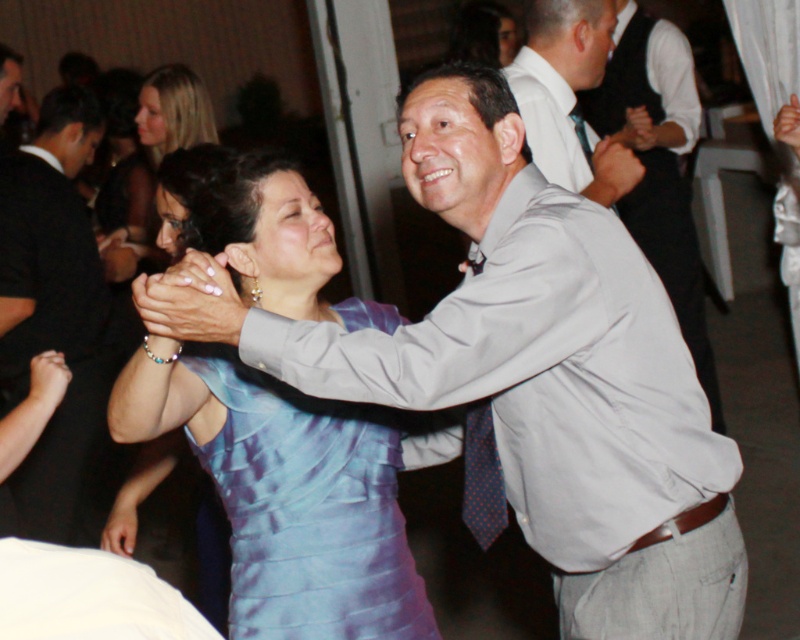
You are a photographer at the event and want to capture a photo of the light gray shirt at upper right and the satin blue dress at upper center. Based on their positions, which one should you focus on first to ensure both are in frame?

The light gray shirt at upper right has a greater height compared to the satin blue dress at upper center, so you should focus on the light gray shirt at upper right first to ensure both are in frame.

You are at the center of the scene and want to locate the matte black suit at left. In which direction should you look to find it?

The matte black suit at left is located at point 0.477 on the x axis and 0.066 on the y axis. Since you are at the center, you should look to the left and slightly downward to find it.

You are a photographer at a formal event. You need to capture a photo that includes both the matte black suit at left and the gray fabric shirt at upper center. Which object should you focus on first to ensure both are in frame?

The matte black suit at left is larger in size than the gray fabric shirt at upper center, so you should focus on the matte black suit at left first to ensure both are in frame.